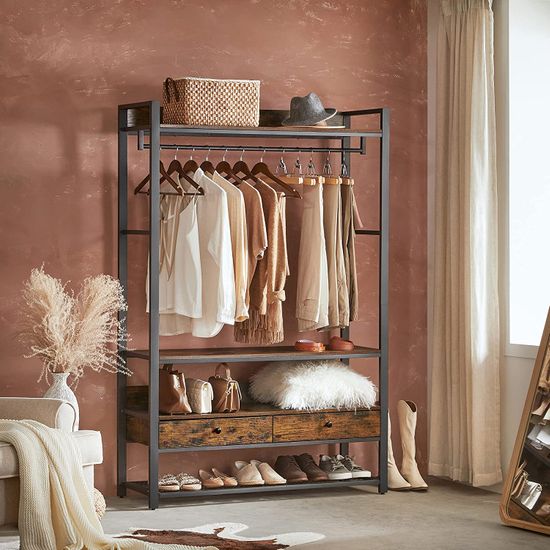
Identify the location of shoes on bottom shelf. (356, 466), (335, 468), (316, 472), (294, 475), (271, 476), (250, 477), (229, 478), (212, 483), (192, 482), (172, 483).